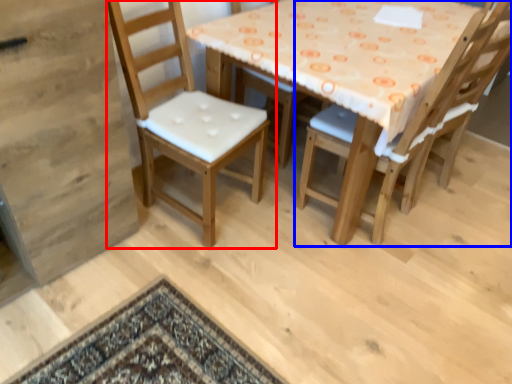
Question: Which point is further to the camera, chair (highlighted by a red box) or chair (highlighted by a blue box)?

Choices:
 (A) chair
 (B) chair

Answer: (B)